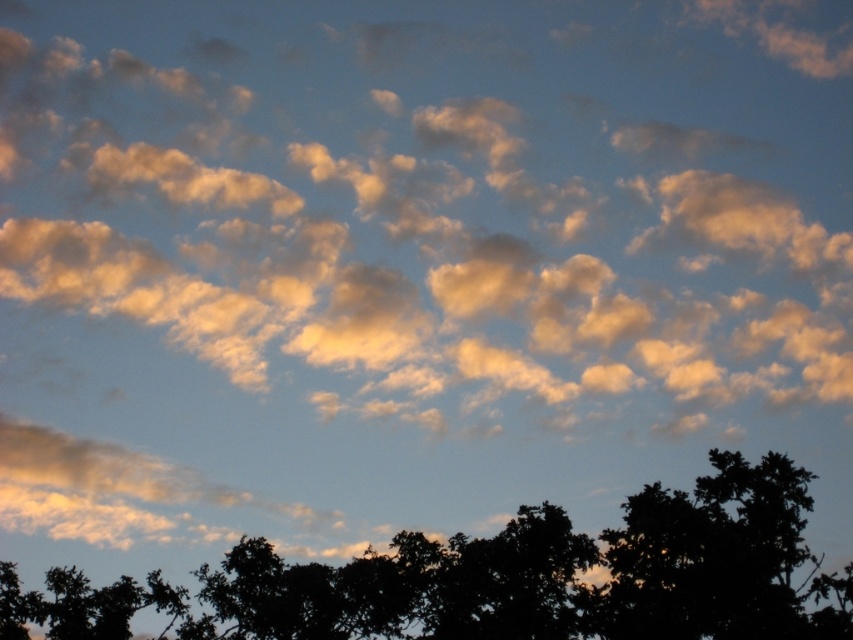
The width and height of the screenshot is (853, 640). In order to click on golden fluffy cloud at upper center in this screenshot , I will do `click(442, 202)`.

From the picture: Is the position of golden fluffy cloud at upper center more distant than that of silhouette leafy tree at lower center?

Yes, it is behind silhouette leafy tree at lower center.

Image resolution: width=853 pixels, height=640 pixels. I want to click on golden fluffy cloud at upper center, so click(442, 202).

The height and width of the screenshot is (640, 853). Identify the location of golden fluffy cloud at upper center. (442, 202).